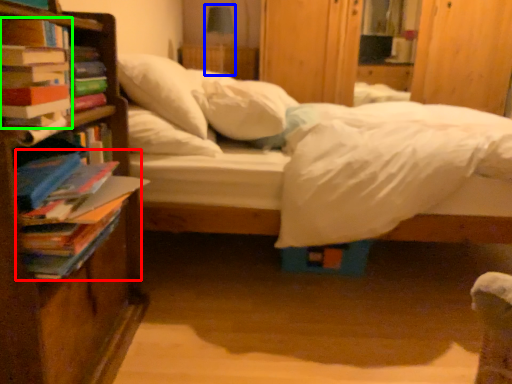
Question: Considering the real-world distances, which object is farthest from book (highlighted by a red box)? table lamp (highlighted by a blue box) or book (highlighted by a green box)?

Choices:
 (A) table lamp
 (B) book

Answer: (A)